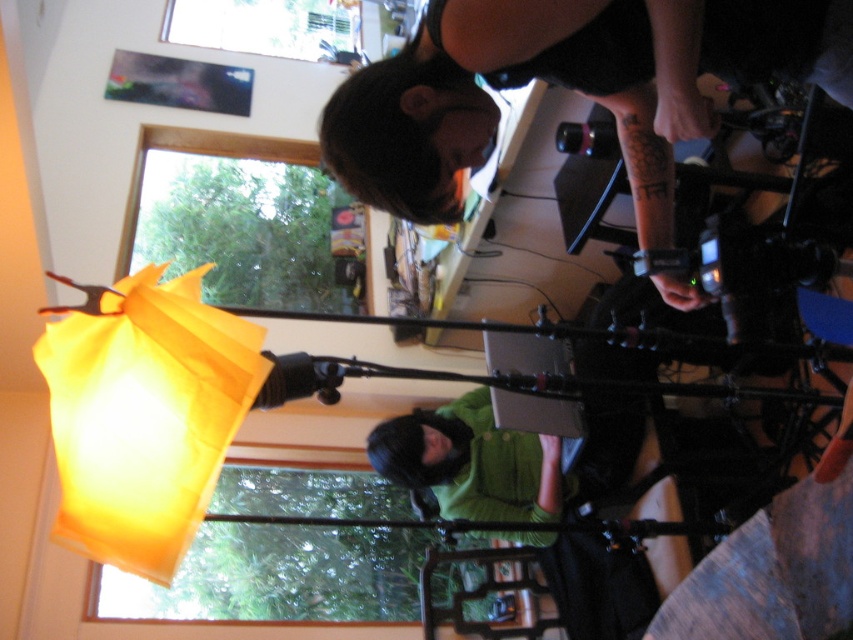
Question: Does black matte shirt at upper center come in front of green matte shirt at lower center?

Choices:
 (A) no
 (B) yes

Answer: (B)

Question: Which object appears closest to the camera in this image?

Choices:
 (A) green matte shirt at lower center
 (B) black matte shirt at upper center
 (C) yellow translucent paper lantern at left

Answer: (B)

Question: Which of the following is the closest to the observer?

Choices:
 (A) yellow translucent paper lantern at left
 (B) black matte shirt at upper center
 (C) green matte shirt at lower center

Answer: (B)

Question: Is black matte shirt at upper center bigger than yellow translucent paper lantern at left?

Choices:
 (A) no
 (B) yes

Answer: (B)

Question: Does black matte shirt at upper center have a lesser width compared to green matte shirt at lower center?

Choices:
 (A) no
 (B) yes

Answer: (A)

Question: Considering the real-world distances, which object is closest to the green matte shirt at lower center?

Choices:
 (A) yellow translucent paper lantern at left
 (B) black matte shirt at upper center

Answer: (B)